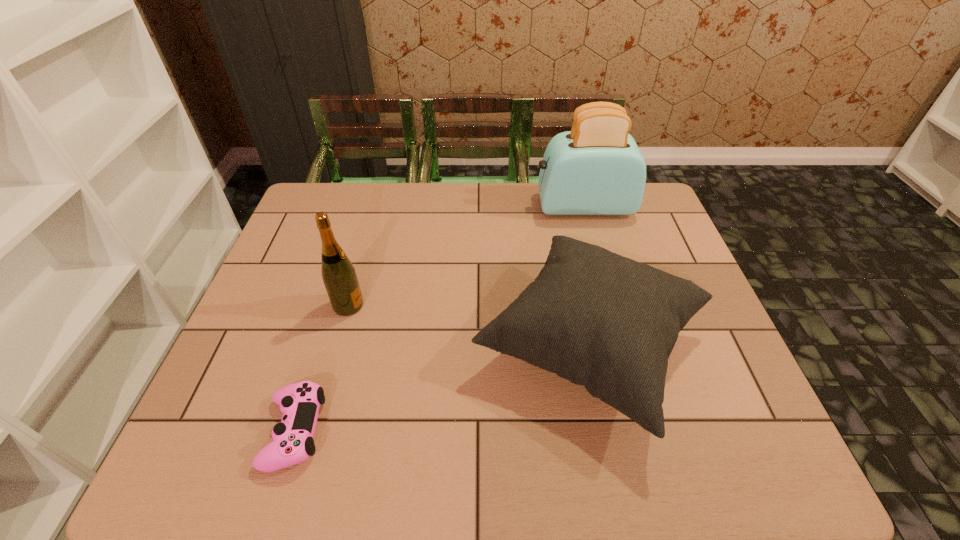
At what (x,y) coordinates should I click in order to perform the action: click on object that is positioned at the far edge. Please return your answer as a coordinate pair (x, y). Image resolution: width=960 pixels, height=540 pixels. Looking at the image, I should click on (597, 168).

Locate an element on the screen. The width and height of the screenshot is (960, 540). cushion that is at the near edge is located at coordinates (601, 320).

Where is `control that is at the near edge`? This screenshot has width=960, height=540. control that is at the near edge is located at coordinates (293, 443).

This screenshot has height=540, width=960. Find the location of `object that is at the left edge`. object that is at the left edge is located at coordinates (293, 443).

You are a GUI agent. You are given a task and a screenshot of the screen. Output one action in this format:
    pyautogui.click(x=<x>, y=<y>)
    Task: Click on the toaster situated at the right edge
    This screenshot has height=540, width=960.
    Given the screenshot: What is the action you would take?
    pyautogui.click(x=597, y=168)

I want to click on cushion that is positioned at the right edge, so click(601, 320).

Identify the location of object at the near left corner. The height and width of the screenshot is (540, 960). (293, 443).

Identify the location of object located at the far right corner. (597, 168).

Where is `object at the near right corner`? This screenshot has height=540, width=960. object at the near right corner is located at coordinates [601, 320].

This screenshot has height=540, width=960. What are the coordinates of `free location at the far edge` in the screenshot? It's located at (556, 216).